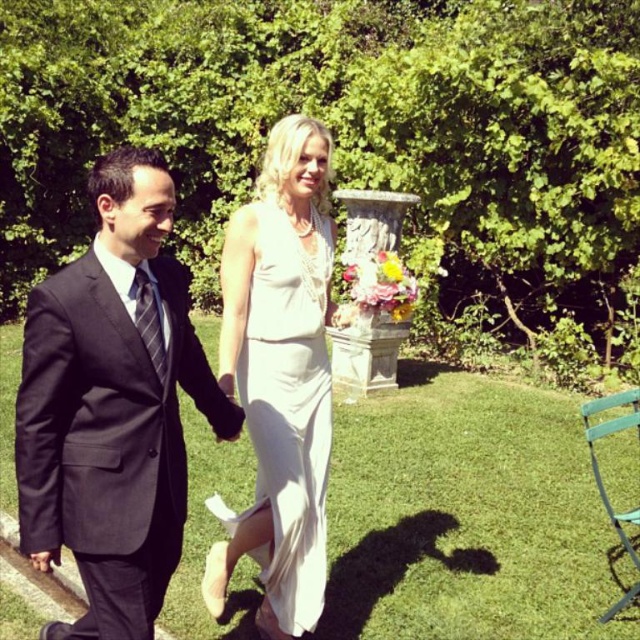
You are a photographer at a wedding ceremony. You need to capture a photo of the black suit at left and the white satin dress at center. Which one is positioned to the left of the other?

The black suit at left is positioned on the left side of white satin dress at center.